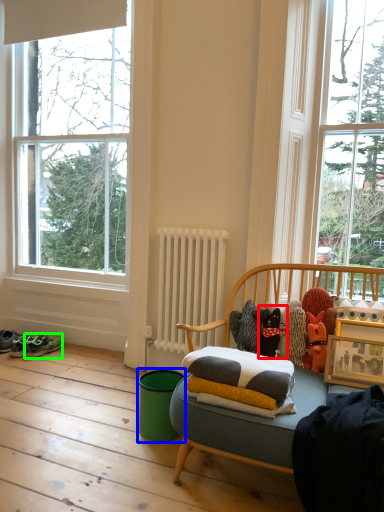
Question: Which object is the farthest from toy (highlighted by a red box)? Choose among these: teal (highlighted by a blue box) or running shoe (highlighted by a green box).

Choices:
 (A) teal
 (B) running shoe

Answer: (B)